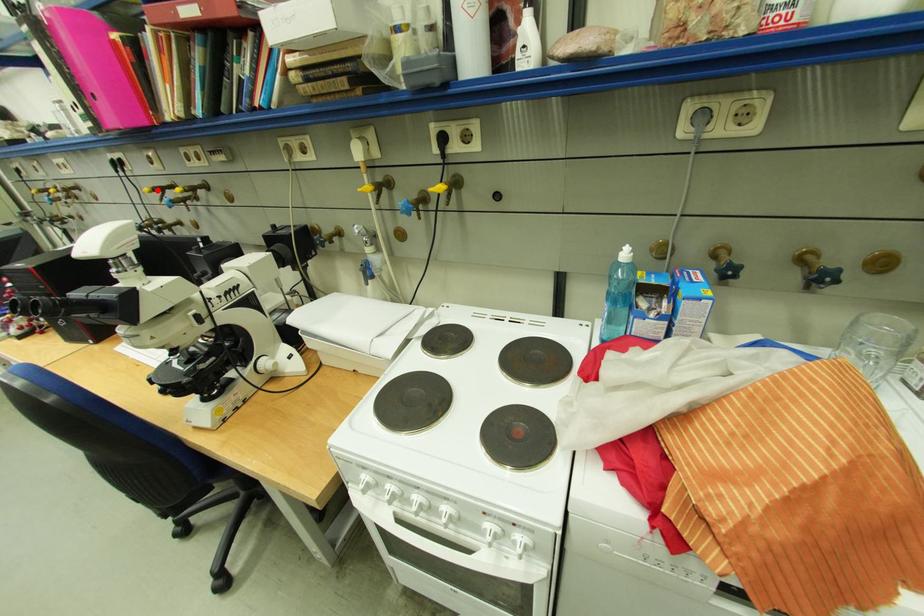
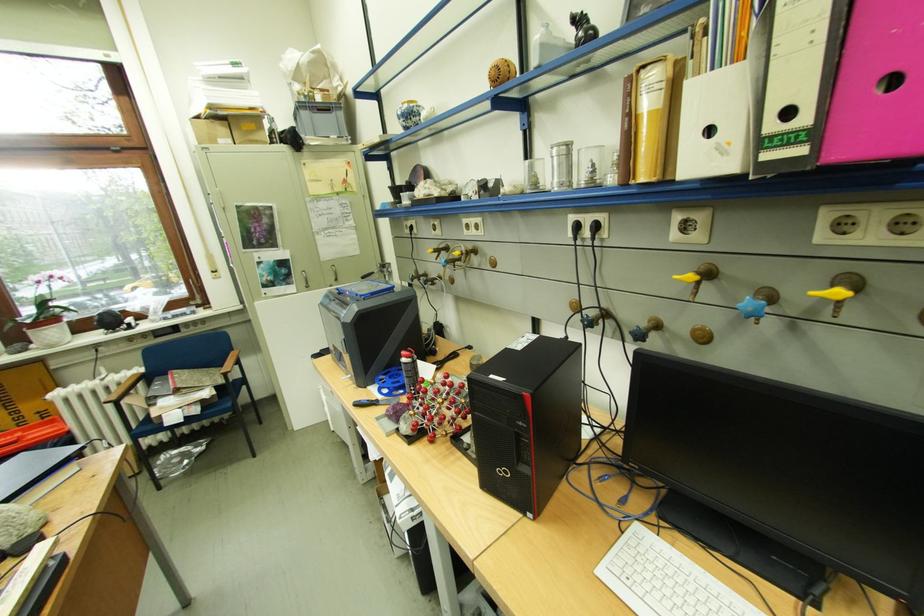
In the second image, find the point that corresponds to the highlighted location in the first image.

(700, 277)